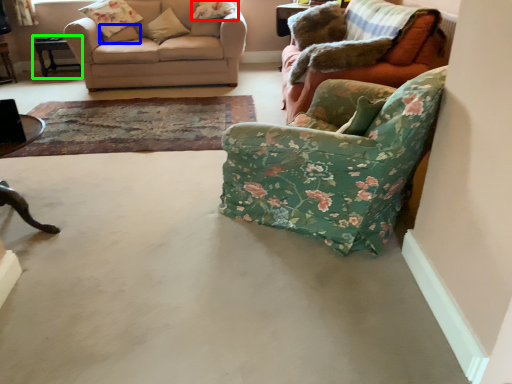
Question: Considering the real-world distances, which object is farthest from pillow (highlighted by a red box)? pillow (highlighted by a blue box) or table (highlighted by a green box)?

Choices:
 (A) pillow
 (B) table

Answer: (B)